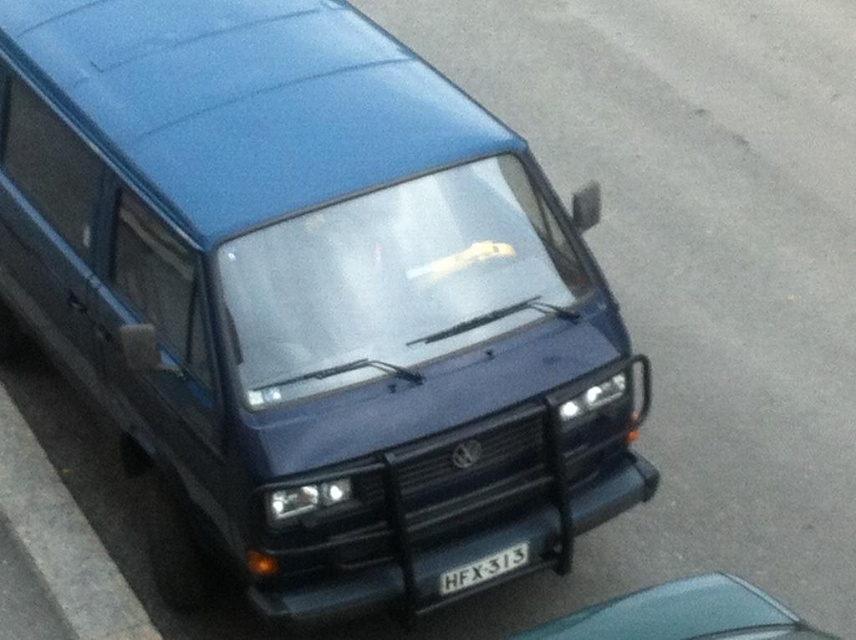
You are a delivery driver who needs to park your teal glossy car at lower right in a spot that is not blocked by the gray concrete curb at lower left. Can you safely park your car there?

The gray concrete curb at lower left is positioned over the teal glossy car at lower right, so the parking spot is blocked by the curb. You cannot safely park your teal glossy car at lower right there.

You are a delivery person who needs to park your teal glossy car at lower right behind the white plastic license plate at center. Is there enough space between them for your car to maneuver?

The teal glossy car at lower right is located below the white plastic license plate at center, so there is sufficient space between them for the car to maneuver.